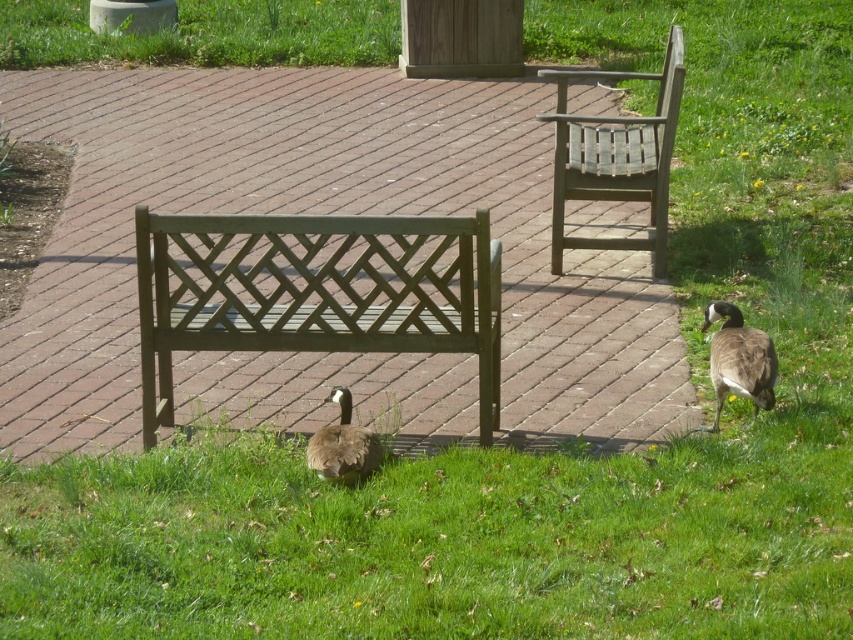
Question: Estimate the real-world distances between objects in this image. Which object is farther from the matte green bench at center?

Choices:
 (A) wooden lattice bench at upper right
 (B) brown matte duck at lower center
 (C) brown feathered duck at lower right
 (D) green grass at lower center

Answer: (A)

Question: Is wooden lattice bench at upper right further to camera compared to brown feathered duck at lower right?

Choices:
 (A) no
 (B) yes

Answer: (B)

Question: Is green grass at lower center bigger than wooden lattice bench at upper right?

Choices:
 (A) no
 (B) yes

Answer: (B)

Question: Which of these objects is positioned farthest from the wooden lattice bench at upper right?

Choices:
 (A) brown matte duck at lower center
 (B) matte green bench at center
 (C) green grass at lower center

Answer: (C)

Question: Does matte green bench at center appear under brown matte duck at lower center?

Choices:
 (A) yes
 (B) no

Answer: (B)

Question: Estimate the real-world distances between objects in this image. Which object is farther from the matte green bench at center?

Choices:
 (A) brown matte duck at lower center
 (B) wooden lattice bench at upper right
 (C) green grass at lower center

Answer: (B)